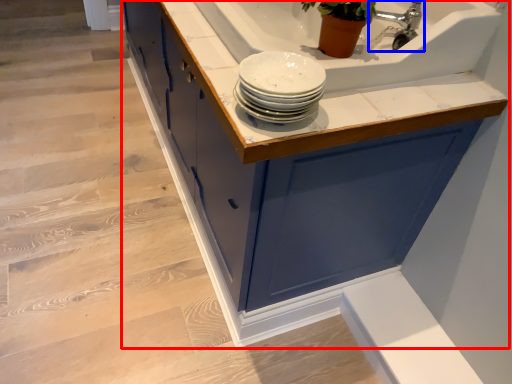
Question: Which object appears closest to the camera in this image, cabinetry (highlighted by a red box) or tap (highlighted by a blue box)?

Choices:
 (A) cabinetry
 (B) tap

Answer: (A)